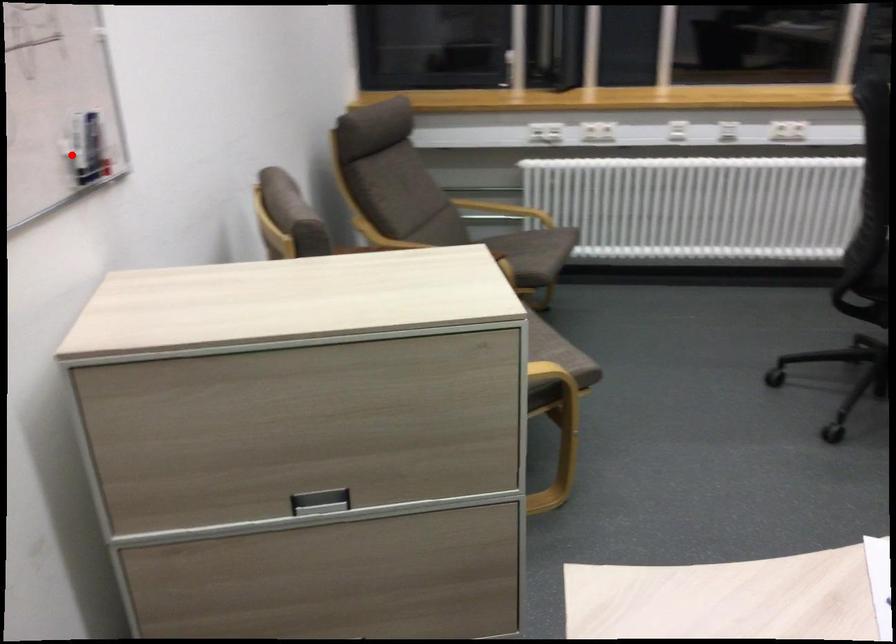
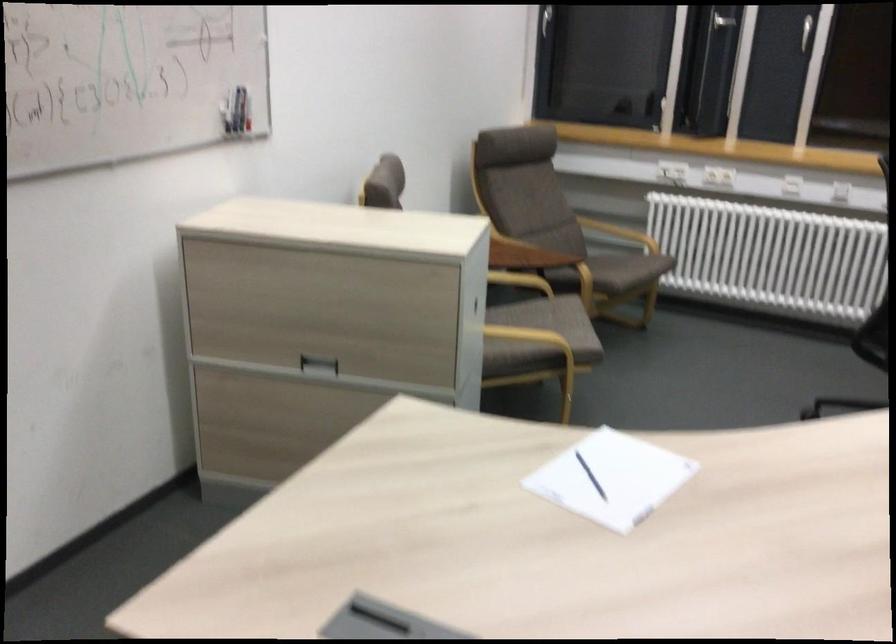
Find the pixel in the second image that matches the highlighted location in the first image.

(228, 111)